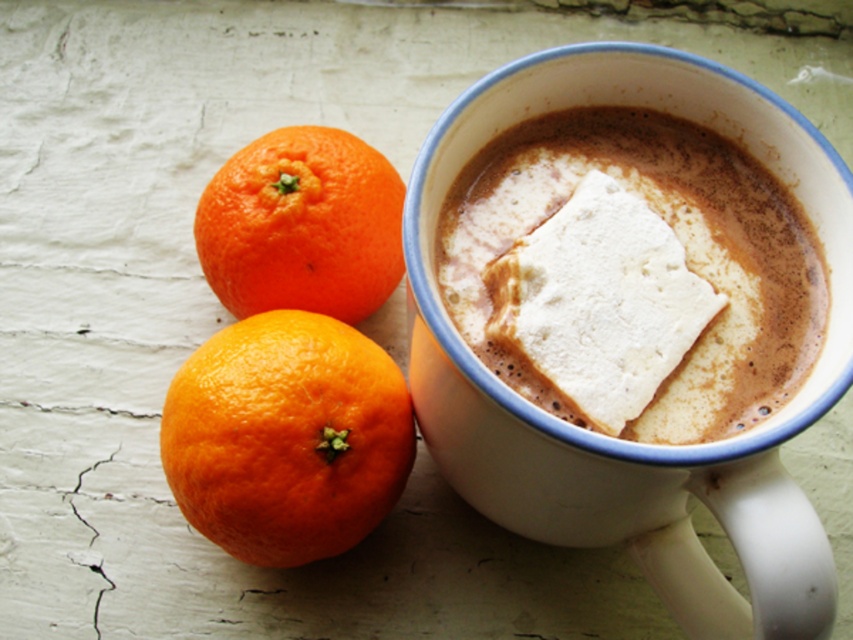
Question: Considering the real-world distances, which object is closest to the white fluffy marshmallow in the cup at center?

Choices:
 (A) orangesmoothfruit at left
 (B) orangesmoothorange at left

Answer: (A)

Question: Is white fluffy marshmallow in the cup at center below orangesmoothorange at left?

Choices:
 (A) yes
 (B) no

Answer: (A)

Question: Is white fluffy marshmallow in the cup at center to the left of orangesmoothfruit at left from the viewer's perspective?

Choices:
 (A) yes
 (B) no

Answer: (B)

Question: Does orangesmoothfruit at left have a larger size compared to orangesmoothorange at left?

Choices:
 (A) no
 (B) yes

Answer: (B)

Question: Estimate the real-world distances between objects in this image. Which object is farther from the white fluffy marshmallow in the cup at center?

Choices:
 (A) orangesmoothorange at left
 (B) orangesmoothfruit at left

Answer: (A)

Question: Estimate the real-world distances between objects in this image. Which object is closer to the orangesmoothfruit at left?

Choices:
 (A) orangesmoothorange at left
 (B) white fluffy marshmallow in the cup at center

Answer: (A)